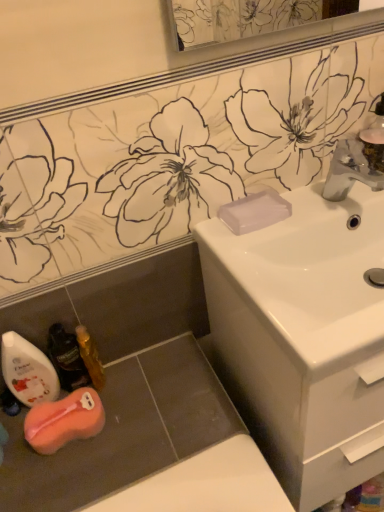
Image resolution: width=384 pixels, height=512 pixels. Find the location of `free space in front of transparent plastic soap at sink right`. free space in front of transparent plastic soap at sink right is located at coordinates (258, 247).